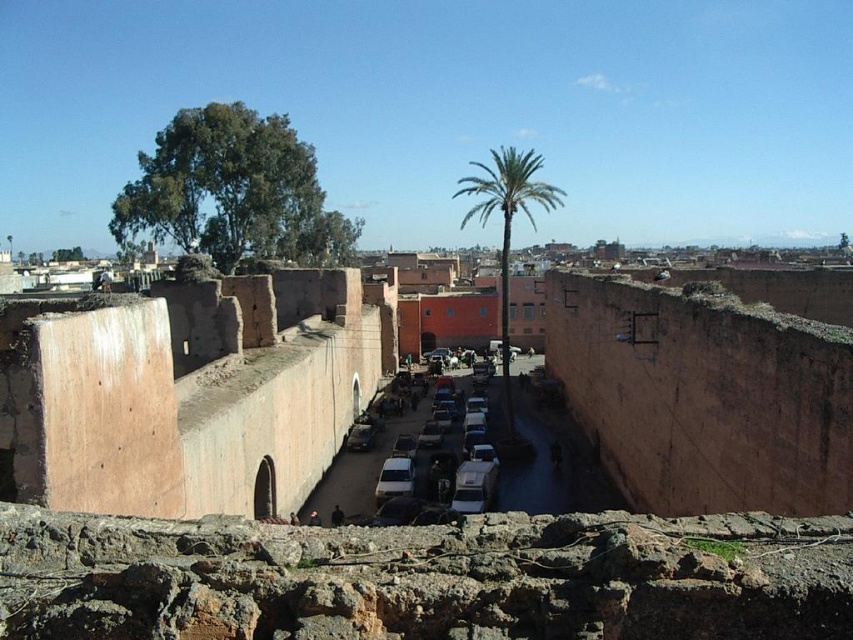
Question: Which object is the closest to the brown rough stone wall at center?

Choices:
 (A) matte white van at center
 (B) rustic stone wall at left

Answer: (B)

Question: Can you confirm if green leafy palm at center is thinner than matte white van at center?

Choices:
 (A) no
 (B) yes

Answer: (A)

Question: Which of the following is the farthest from the observer?

Choices:
 (A) (479, 419)
 (B) (373, 435)
 (C) (646, 380)
 (D) (248, 349)

Answer: (B)

Question: Based on their relative distances, which object is farther from the white matte van at center?

Choices:
 (A) matte white van at center
 (B) green leafy palm at center
 (C) brown rough stone wall at center
 (D) rustic stone wall at left

Answer: (B)

Question: Can you confirm if brown rough stone wall at center is positioned to the right of green leafy palm at center?

Choices:
 (A) no
 (B) yes

Answer: (B)

Question: Is rustic stone wall at left below white matte van at center?

Choices:
 (A) yes
 (B) no

Answer: (B)